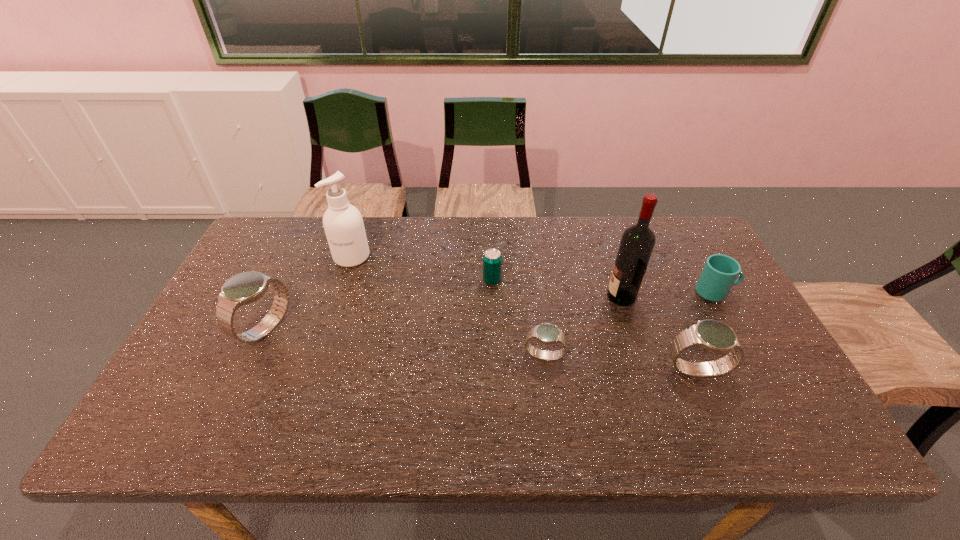
Locate an element on the screen. unoccupied area between the second watch from left to right and the rightmost watch is located at coordinates (620, 363).

Locate an element on the screen. The width and height of the screenshot is (960, 540). free area in between the fourth shortest object and the leftmost watch is located at coordinates (481, 349).

Where is `blank region between the cup and the beer can`? The width and height of the screenshot is (960, 540). blank region between the cup and the beer can is located at coordinates (604, 287).

Find the location of a particular element. This screenshot has width=960, height=540. unoccupied position between the cleansing agent and the shortest watch is located at coordinates (448, 306).

You are a GUI agent. You are given a task and a screenshot of the screen. Output one action in this format:
    pyautogui.click(x=<x>, y=<y>)
    Task: Click on the unoccupied position between the farthest object and the beer can
    The image size is (960, 540).
    Given the screenshot: What is the action you would take?
    pyautogui.click(x=421, y=269)

Locate an element on the screen. vacant area that lies between the cleansing agent and the beer can is located at coordinates (421, 269).

Find the location of a particular element. The image size is (960, 540). vacant area that lies between the cup and the leftmost object is located at coordinates (491, 310).

The height and width of the screenshot is (540, 960). What are the coordinates of `free space that is in between the cup and the fifth object from right to left` in the screenshot? It's located at (604, 287).

This screenshot has width=960, height=540. I want to click on free point between the second watch from left to right and the leftmost object, so click(405, 342).

Identify which object is the third nearest to the beer can. Please provide its 2D coordinates. Your answer should be formatted as a tuple, i.e. [(x, y)], where the tuple contains the x and y coordinates of a point satisfying the conditions above.

[(343, 223)]